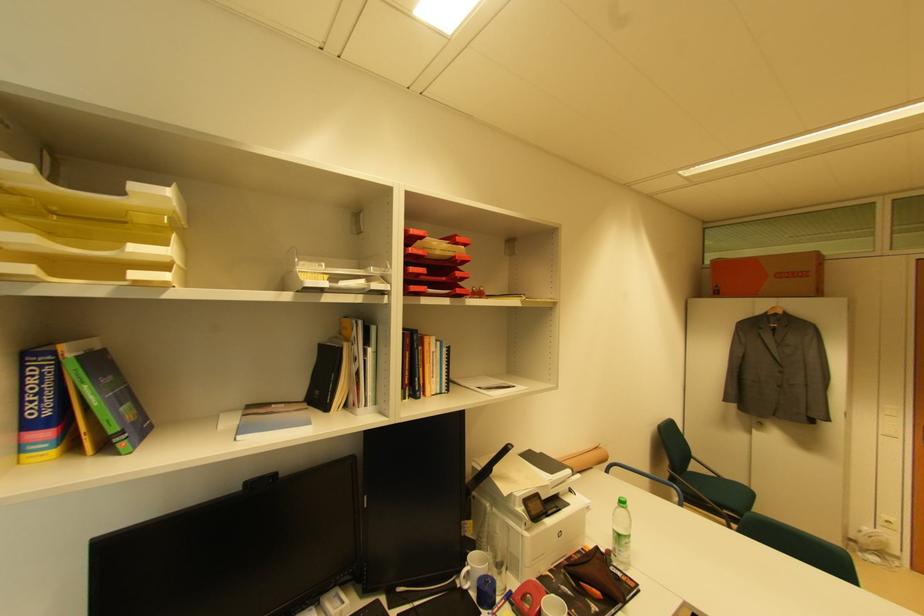
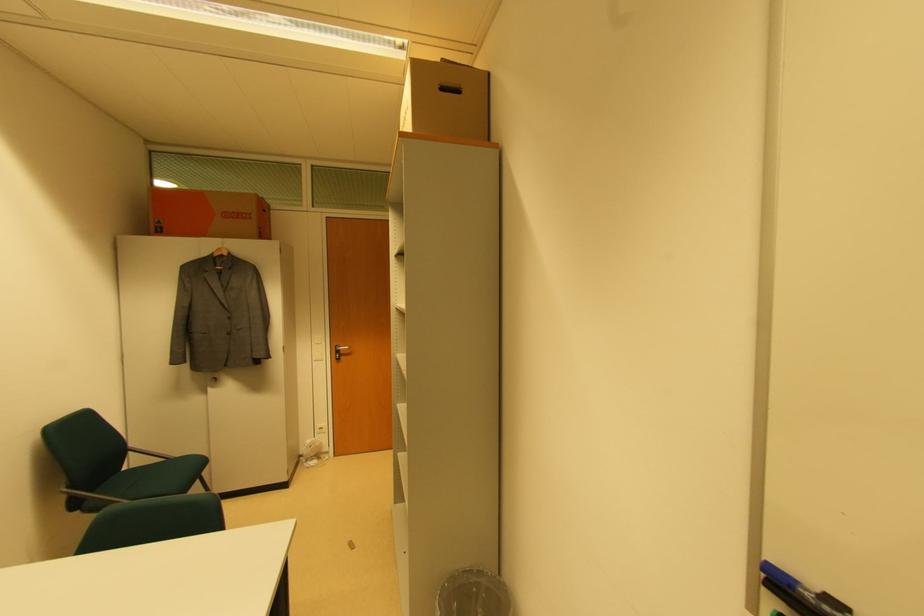
Find the pixel in the second image that matches point 690,472 in the first image.

(126, 471)